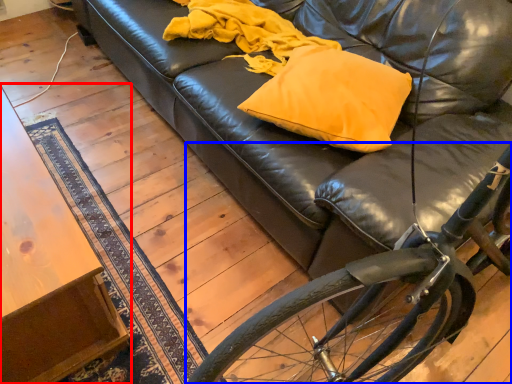
Question: Which object appears closest to the camera in this image, table (highlighted by a red box) or bicycle (highlighted by a blue box)?

Choices:
 (A) table
 (B) bicycle

Answer: (B)